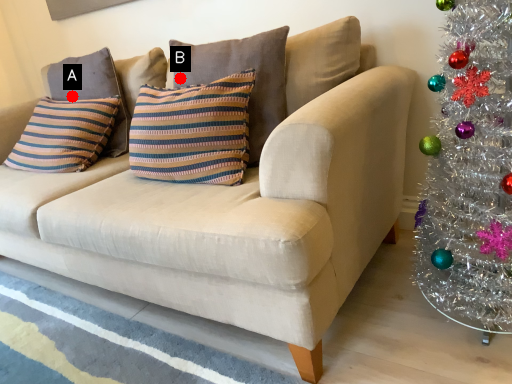
Question: Two points are circled on the image, labeled by A and B beside each circle. Which point is farther to the camera?

Choices:
 (A) A is further
 (B) B is further

Answer: (A)